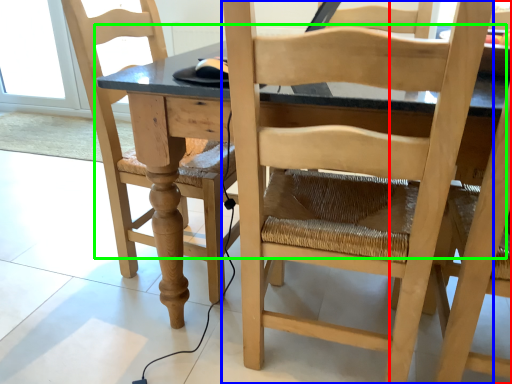
Question: Which is farther away from chair (highlighted by a red box)? chair (highlighted by a blue box) or table (highlighted by a green box)?

Choices:
 (A) chair
 (B) table

Answer: (B)